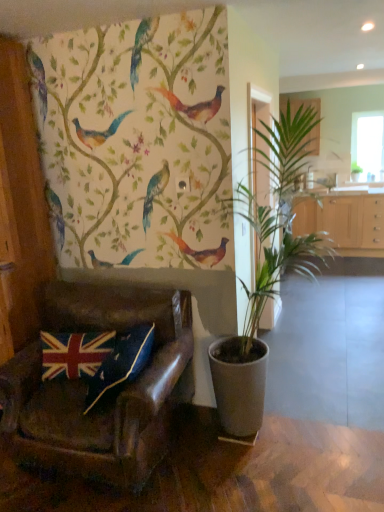
Question: Considering the relative sizes of transparent glass window at upper right and light wood cabinet at center, the 1th cabinetry when ordered from bottom to top, in the image provided, is transparent glass window at upper right taller than light wood cabinet at center, the 1th cabinetry when ordered from bottom to top,?

Choices:
 (A) no
 (B) yes

Answer: (B)

Question: Does transparent glass window at upper right have a lesser height compared to light wood cabinet at center, which appears as the second cabinetry when viewed from the top?

Choices:
 (A) no
 (B) yes

Answer: (A)

Question: Considering the relative sizes of transparent glass window at upper right and light wood cabinet at center, which appears as the second cabinetry when viewed from the top, in the image provided, is transparent glass window at upper right smaller than light wood cabinet at center, which appears as the second cabinetry when viewed from the top,?

Choices:
 (A) no
 (B) yes

Answer: (B)

Question: Is transparent glass window at upper right oriented away from light wood cabinet at center, which appears as the second cabinetry when viewed from the top?

Choices:
 (A) no
 (B) yes

Answer: (A)

Question: From a real-world perspective, is transparent glass window at upper right located beneath light wood cabinet at center, which appears as the second cabinetry when viewed from the top?

Choices:
 (A) no
 (B) yes

Answer: (A)

Question: In terms of size, does wooden cabinet at upper right, the second cabinetry from the bottom, appear bigger or smaller than leather at left?

Choices:
 (A) big
 (B) small

Answer: (B)

Question: Is wooden cabinet at upper right, which is the 1th cabinetry in top-to-bottom order, in front of or behind leather at left in the image?

Choices:
 (A) front
 (B) behind

Answer: (B)

Question: From the image's perspective, is wooden cabinet at upper right, which is the 1th cabinetry in top-to-bottom order, positioned above or below leather at left?

Choices:
 (A) above
 (B) below

Answer: (A)

Question: From a real-world perspective, is wooden cabinet at upper right, the second cabinetry from the bottom, physically located above or below leather at left?

Choices:
 (A) above
 (B) below

Answer: (A)

Question: Do you think leather at left is within light wood cabinet at center, the 1th cabinetry when ordered from bottom to top, or outside of it?

Choices:
 (A) outside
 (B) inside

Answer: (A)

Question: Would you say leather at left is to the left or to the right of light wood cabinet at center, which appears as the second cabinetry when viewed from the top, in the picture?

Choices:
 (A) right
 (B) left

Answer: (B)

Question: In the image, is leather at left positioned in front of or behind light wood cabinet at center, which appears as the second cabinetry when viewed from the top?

Choices:
 (A) front
 (B) behind

Answer: (A)

Question: Considering the positions of leather at left and light wood cabinet at center, which appears as the second cabinetry when viewed from the top, in the image, is leather at left bigger or smaller than light wood cabinet at center, which appears as the second cabinetry when viewed from the top,?

Choices:
 (A) big
 (B) small

Answer: (A)

Question: Choose the correct answer: Is leather at left inside transparent glass window at upper right or outside it?

Choices:
 (A) outside
 (B) inside

Answer: (A)

Question: Considering the positions of leather at left and transparent glass window at upper right in the image, is leather at left wider or thinner than transparent glass window at upper right?

Choices:
 (A) wide
 (B) thin

Answer: (A)